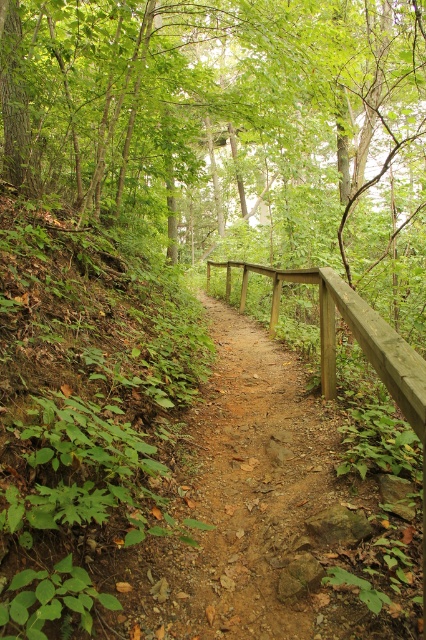
You are a hiker carrying a wide backpack and want to pass through the narrow trail between the green leafy tree at center and the wooden rail at center. Can your backpack fit through the space between them?

The green leafy tree at center is wider than the wooden rail at center, so the space between them may be too narrow for a wide backpack to pass through safely.

You are standing on the forest trail and want to take a photo of the green leafy hillside at left. Your camera has a minimum focusing distance of 1 meter. Will you need to step back to take a clear photo?

The green leafy hillside at left is 1.24 meters from viewer, which is beyond the camera minimum focusing distance of 1 meter. Therefore, you can take a clear photo without needing to step back.